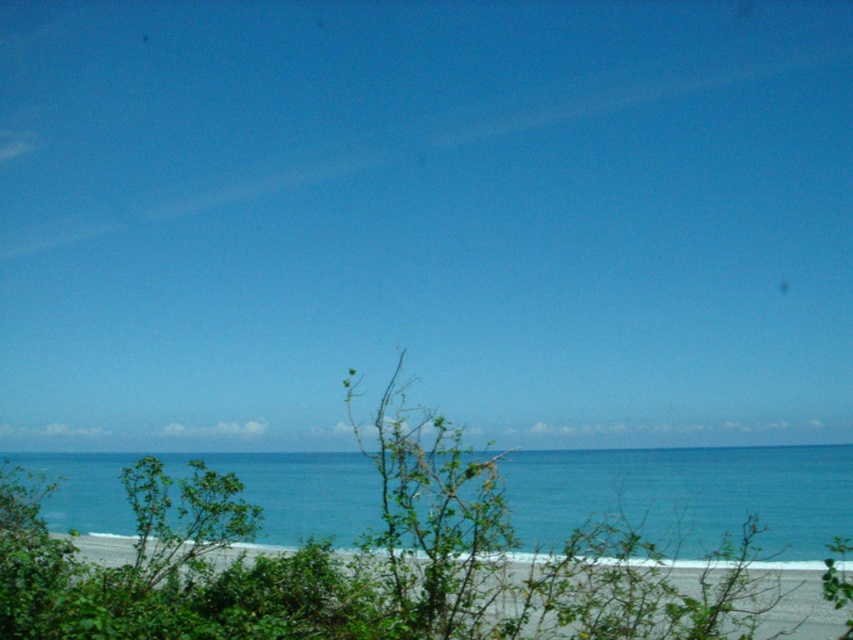
Question: Which object is farther from the camera taking this photo?

Choices:
 (A) blue water at center
 (B) green leafy shrub at center

Answer: (A)

Question: Can you confirm if green leafy shrub at center is wider than blue water at center?

Choices:
 (A) no
 (B) yes

Answer: (A)

Question: Can you confirm if green leafy shrub at center is smaller than blue water at center?

Choices:
 (A) no
 (B) yes

Answer: (B)

Question: Can you confirm if green leafy shrub at center is wider than blue water at center?

Choices:
 (A) yes
 (B) no

Answer: (B)